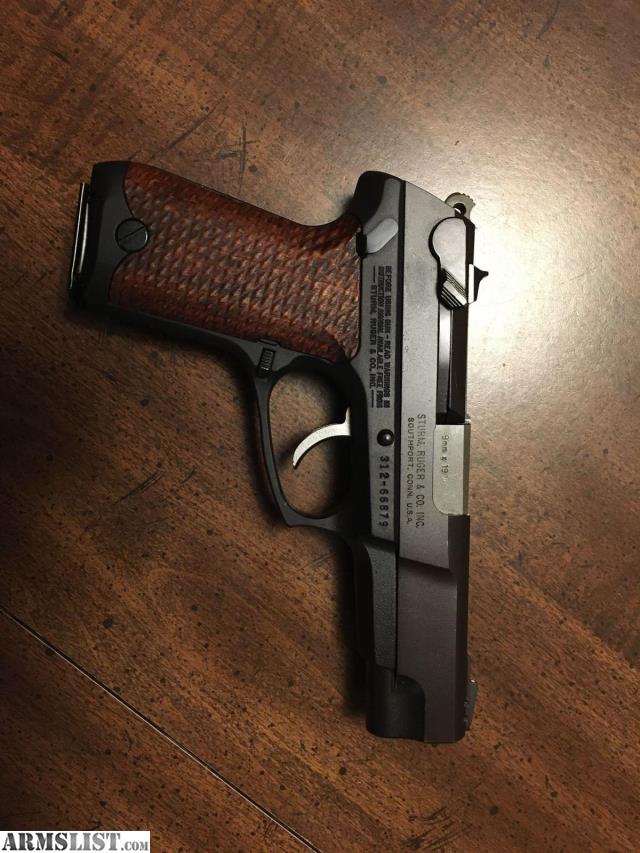
This screenshot has width=640, height=853. What are the coordinates of `handle` in the screenshot? It's located at (244, 274).